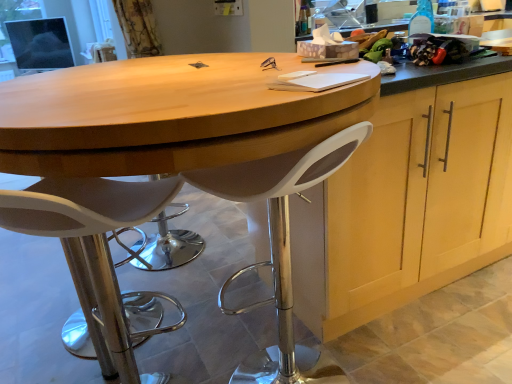
The height and width of the screenshot is (384, 512). I want to click on free spot to the right of white plastic stool at center, the second chair viewed from the left, so click(382, 351).